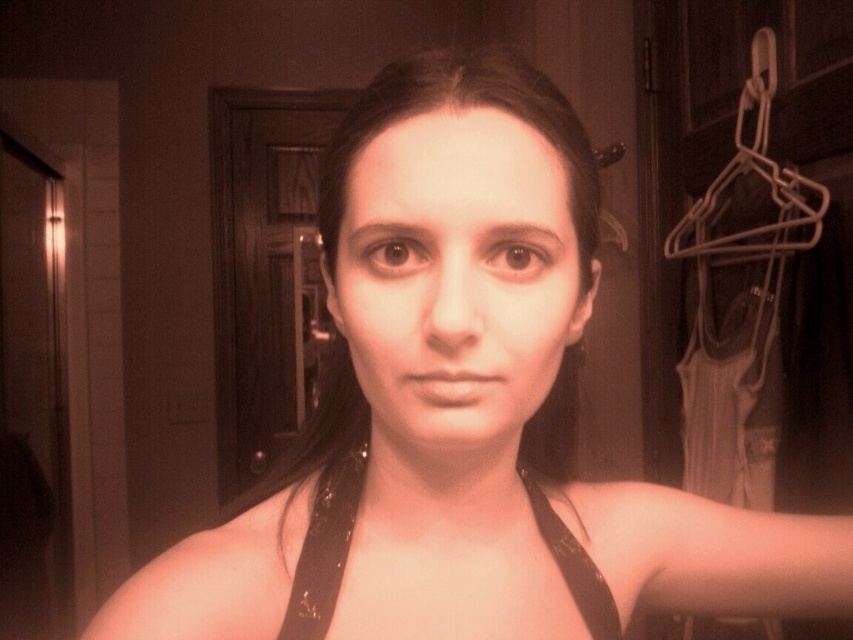
Can you confirm if black leather strap at center is shorter than white plastic hanger at upper right?

Correct, black leather strap at center is not as tall as white plastic hanger at upper right.

This screenshot has height=640, width=853. What are the coordinates of `black leather strap at center` in the screenshot? It's located at (325, 548).

Find the location of a particular element. black leather strap at center is located at coordinates (325, 548).

Does point (467, 236) come closer to viewer compared to point (305, 573)?

That is True.

Can you confirm if smooth skin face at center is positioned below black leather strap at center?

Actually, smooth skin face at center is above black leather strap at center.

Who is more forward, (541, 342) or (366, 452)?

Point (541, 342)

The image size is (853, 640). Find the location of `smooth skin face at center`. smooth skin face at center is located at coordinates (457, 276).

Is point (476, 435) positioned in front of point (811, 211)?

Yes, it is.

What do you see at coordinates (457, 276) in the screenshot? This screenshot has height=640, width=853. I see `smooth skin face at center` at bounding box center [457, 276].

Is point (442, 394) positioned behind point (712, 240)?

No.

This screenshot has width=853, height=640. I want to click on smooth skin face at center, so click(457, 276).